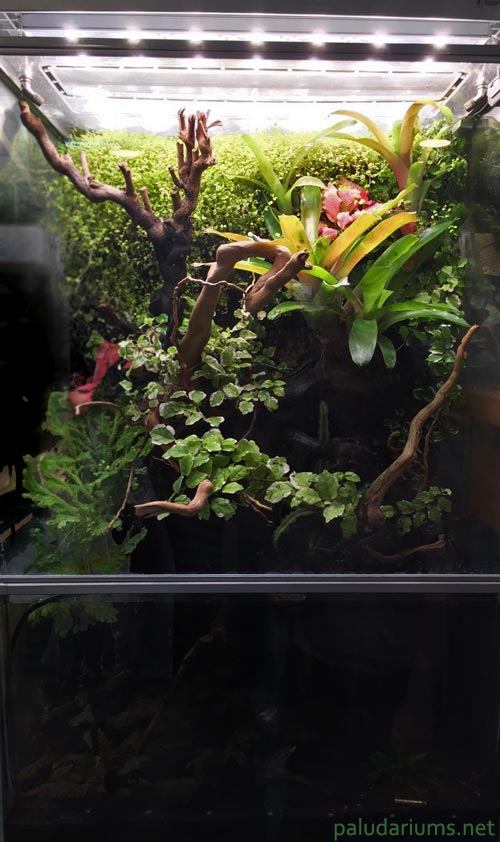
Find the location of a particular element. lights is located at coordinates (71, 32), (134, 34), (195, 40), (259, 36), (322, 39), (385, 35), (439, 39).